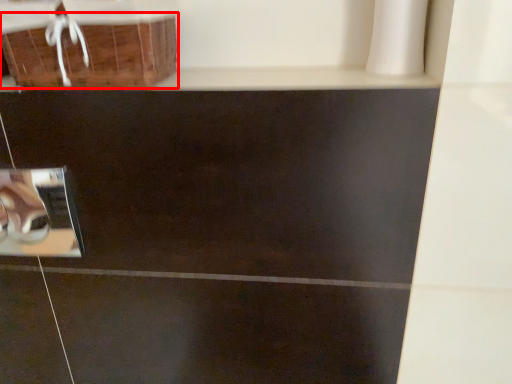
Question: From the image's perspective, what is the correct spatial relationship of basket (annotated by the red box) in relation to square?

Choices:
 (A) below
 (B) above

Answer: (B)